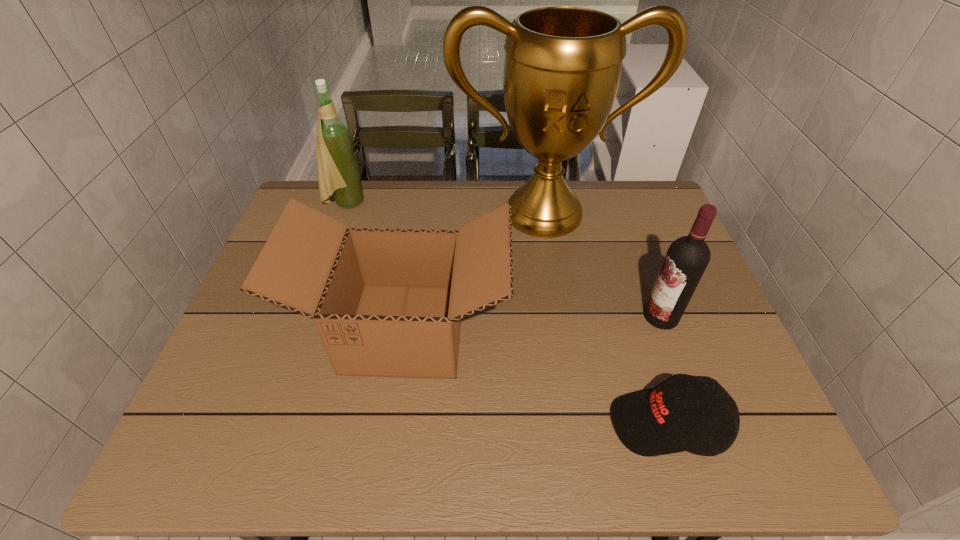
This screenshot has height=540, width=960. Find the location of `free region at the far left corner of the desktop`. free region at the far left corner of the desktop is located at coordinates (309, 193).

Where is `free space at the near left corner`? The width and height of the screenshot is (960, 540). free space at the near left corner is located at coordinates (266, 430).

This screenshot has width=960, height=540. In the image, there is a desktop. In order to click on vacant space at the near right corner in this screenshot , I will do `click(773, 450)`.

Where is `free space between the nearest object and the second shortest object`? This screenshot has height=540, width=960. free space between the nearest object and the second shortest object is located at coordinates (537, 376).

The width and height of the screenshot is (960, 540). I want to click on free space between the fourth tallest object and the nearest object, so click(x=537, y=376).

Find the location of a particular element. The height and width of the screenshot is (540, 960). vacant space in between the box and the shortest object is located at coordinates (537, 376).

Find the location of a particular element. The image size is (960, 540). vacant area that lies between the tallest object and the right wine bottle is located at coordinates (602, 265).

Where is `free space between the tallest object and the farther wine bottle`? free space between the tallest object and the farther wine bottle is located at coordinates (444, 208).

Locate an element on the screen. empty location between the tallest object and the nearer wine bottle is located at coordinates (602, 265).

This screenshot has height=540, width=960. I want to click on free space between the nearest object and the trophy cup, so (606, 319).